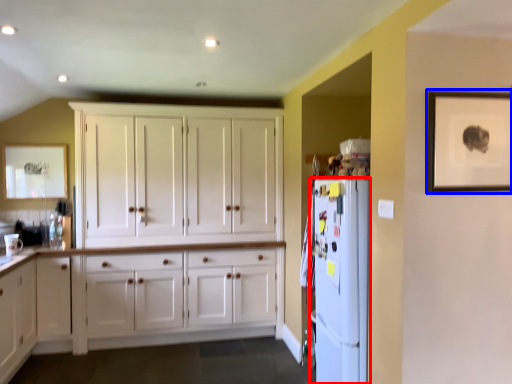
Question: Which of the following is the closest to the observer, refrigerator (highlighted by a red box) or picture frame (highlighted by a blue box)?

Choices:
 (A) refrigerator
 (B) picture frame

Answer: (B)